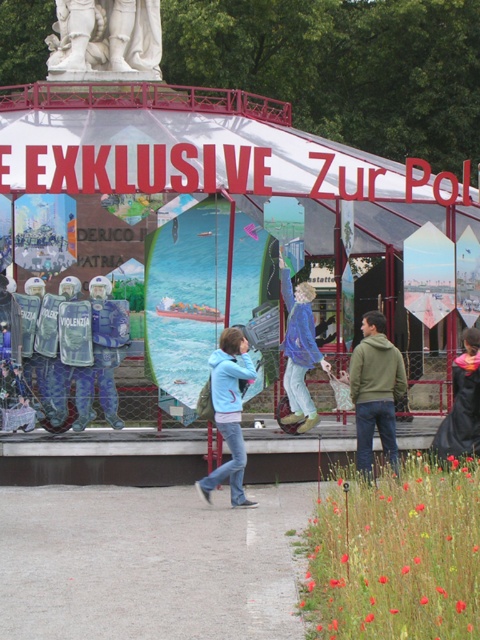
Question: Which point appears farthest from the camera in this image?

Choices:
 (A) (94, 305)
 (B) (468, 397)

Answer: (A)

Question: Is white marble statue at upper left smaller than blue reflective vest at center?

Choices:
 (A) yes
 (B) no

Answer: (B)

Question: Is white fabric canopy at upper center to the right of green matte hoodie at center from the viewer's perspective?

Choices:
 (A) yes
 (B) no

Answer: (B)

Question: Does white fabric canopy at upper center have a larger size compared to blue denim jacket at center?

Choices:
 (A) yes
 (B) no

Answer: (A)

Question: Which point is closer to the camera?

Choices:
 (A) blue denim jacket at center
 (B) blue reflective vest at center
 (C) green matte hoodie at center
 (D) light blue hoodie at center

Answer: (D)

Question: Among these points, which one is nearest to the camera?

Choices:
 (A) (464, 380)
 (B) (309, 310)

Answer: (A)